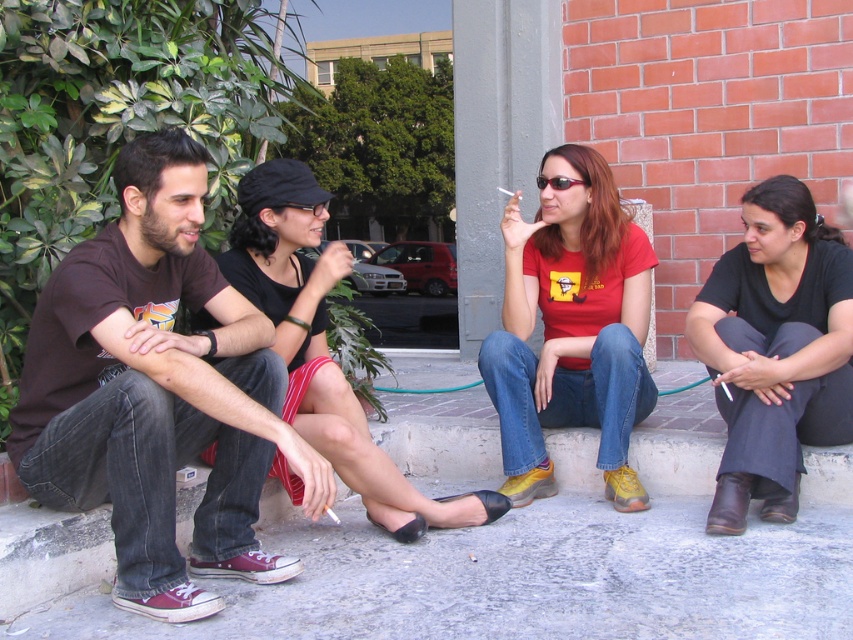
Between dark brown t-shirt at left and matte black cap at center, which one appears on the left side from the viewer's perspective?

dark brown t-shirt at left is more to the left.

Is the position of dark brown t-shirt at left more distant than that of matte black cap at center?

No.

Who is more forward, [67,259] or [305,180]?

Point [67,259]

At what (x,y) coordinates should I click in order to perform the action: click on dark brown t-shirt at left. Please return your answer as a coordinate pair (x, y). Looking at the image, I should click on (157, 392).

Which is in front, point (508, 422) or point (469, 516)?

Point (469, 516) is in front.

Is matte red t-shirt at center wider than matte black cap at center?

In fact, matte red t-shirt at center might be narrower than matte black cap at center.

At what (x,y) coordinates should I click in order to perform the action: click on matte red t-shirt at center. Please return your answer as a coordinate pair (x, y). Looking at the image, I should click on (572, 326).

In the scene shown: Is dark brown t-shirt at left positioned at the back of matte red t-shirt at center?

No, it is in front of matte red t-shirt at center.

Is dark brown t-shirt at left to the right of matte red t-shirt at center from the viewer's perspective?

No, dark brown t-shirt at left is not to the right of matte red t-shirt at center.

Is point (236, 577) positioned before point (492, 346)?

Yes, point (236, 577) is in front of point (492, 346).

I want to click on dark brown t-shirt at left, so click(157, 392).